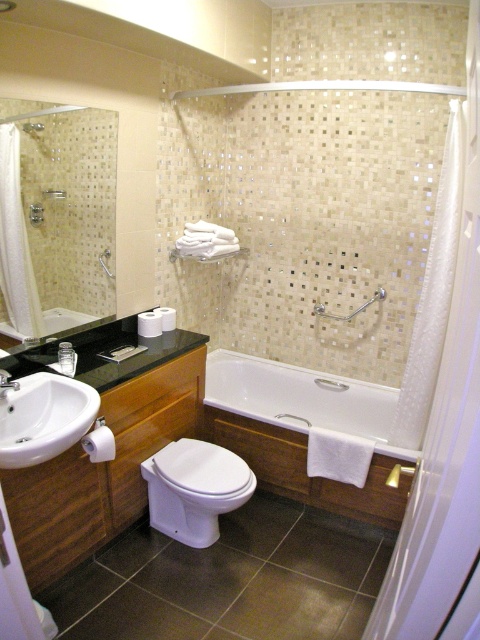
Question: Which point is farther to the camera?

Choices:
 (A) white sheer curtain at right
 (B) white glossy sink at lower left
 (C) white translucent screen door at right

Answer: (A)

Question: Is white glossy bathtub at center thinner than brushed metal faucet at sink left?

Choices:
 (A) no
 (B) yes

Answer: (A)

Question: Is white sheer curtain at right closer to the viewer compared to matte silver shower at upper center?

Choices:
 (A) no
 (B) yes

Answer: (B)

Question: Which of the following is the farthest from the observer?

Choices:
 (A) white glossy bathtub at center
 (B) white translucent screen door at right
 (C) matte silver shower at upper center

Answer: (A)

Question: Which of the following is the farthest from the observer?

Choices:
 (A) wooden vanity at center
 (B) white glossy toilet at center

Answer: (B)

Question: Observing the image, what is the correct spatial positioning of white translucent screen door at right in reference to brushed metal faucet at sink left?

Choices:
 (A) right
 (B) left

Answer: (A)